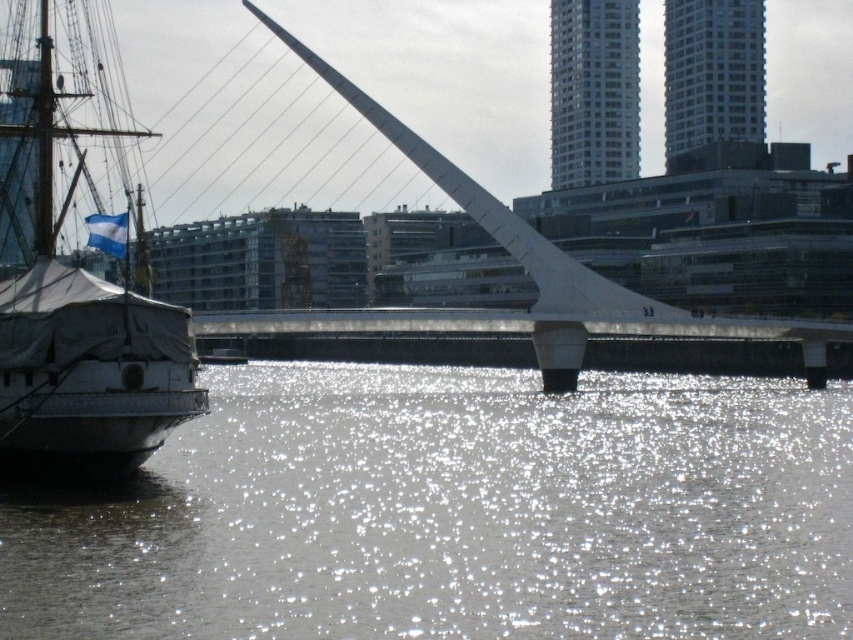
You are a sailor on a small boat that requires a minimum of 10 meters of open water to maneuver safely. You see the sparkling silver water at center and the white canvas sailboat at left. Is there enough space between them for your boat to safely navigate?

The distance between the sparkling silver water at center and the white canvas sailboat at left is 15.35 meters, which is more than the required 10 meters. Therefore, there is sufficient space for your boat to navigate safely.

You are standing at the waterfront and want to reach the point marked at coordinates (287, 547). If your walking speed is 3 feet per second, how many seconds will it take you to reach that point?

The point marked at coordinates (287, 547) is 175.23 feet away. At a walking speed of 3 feet per second, it would take approximately 58.41 seconds to reach the point.

Looking at this image, you are standing on the deck of the white canvas sailboat at left and want to reach the sparkling silver water at center. In which direction should you move to get there?

You should move to the right since the sparkling silver water at center is located to the right of the white canvas sailboat at left according to the description.